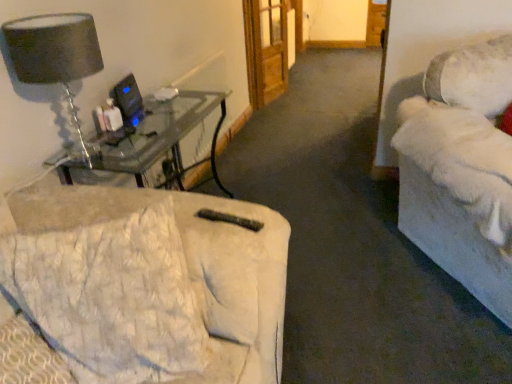
Locate an element on the screen. free space to the right of wooden door at center is located at coordinates (308, 94).